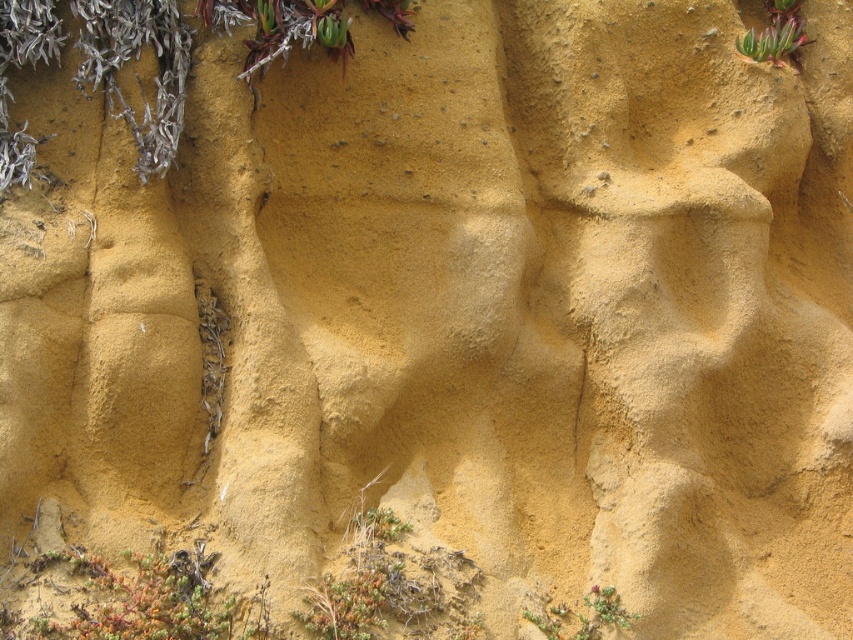
Question: Does green succulent at lower left come in front of green succulent at upper right?

Choices:
 (A) no
 (B) yes

Answer: (B)

Question: Estimate the real-world distances between objects in this image. Which object is closer to the green succulent at lower right?

Choices:
 (A) green succulent at upper right
 (B) green succulent at lower left

Answer: (B)

Question: Is green succulent at lower left smaller than green succulent at lower right?

Choices:
 (A) yes
 (B) no

Answer: (B)

Question: Which of the following is the closest to the observer?

Choices:
 (A) green succulent at lower left
 (B) green succulent at lower right

Answer: (A)

Question: Can you confirm if green succulent at lower left is thinner than green succulent at upper right?

Choices:
 (A) yes
 (B) no

Answer: (B)

Question: Which point is closer to the camera?

Choices:
 (A) click(96, 557)
 (B) click(590, 589)

Answer: (A)